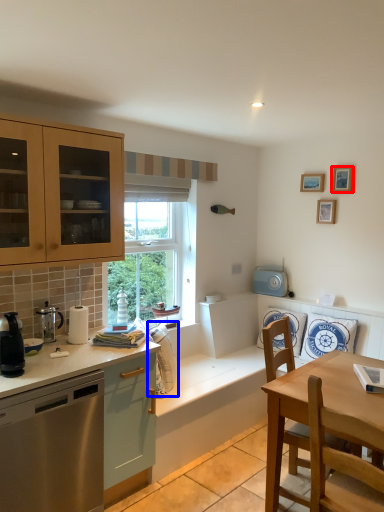
Question: Which of the following is the farthest to the observer, picture frame (highlighted by a red box) or appliance (highlighted by a blue box)?

Choices:
 (A) picture frame
 (B) appliance

Answer: (A)